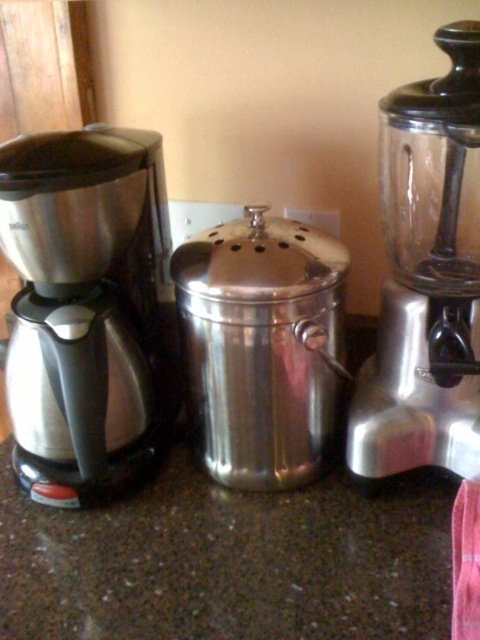
Question: Which object appears farthest from the camera in this image?

Choices:
 (A) satin silver blender at right
 (B) brushed metal coffee maker at left

Answer: (B)

Question: Which point is farther to the camera?

Choices:
 (A) brushed metal coffee maker at left
 (B) satin silver blender at right

Answer: (A)

Question: Is brushed metal coffee maker at left further to camera compared to satin silver blender at right?

Choices:
 (A) no
 (B) yes

Answer: (B)

Question: Does brushed metal coffee maker at left have a larger size compared to satin silver blender at right?

Choices:
 (A) yes
 (B) no

Answer: (A)

Question: Does brushed metal coffee maker at left have a smaller size compared to satin silver blender at right?

Choices:
 (A) yes
 (B) no

Answer: (B)